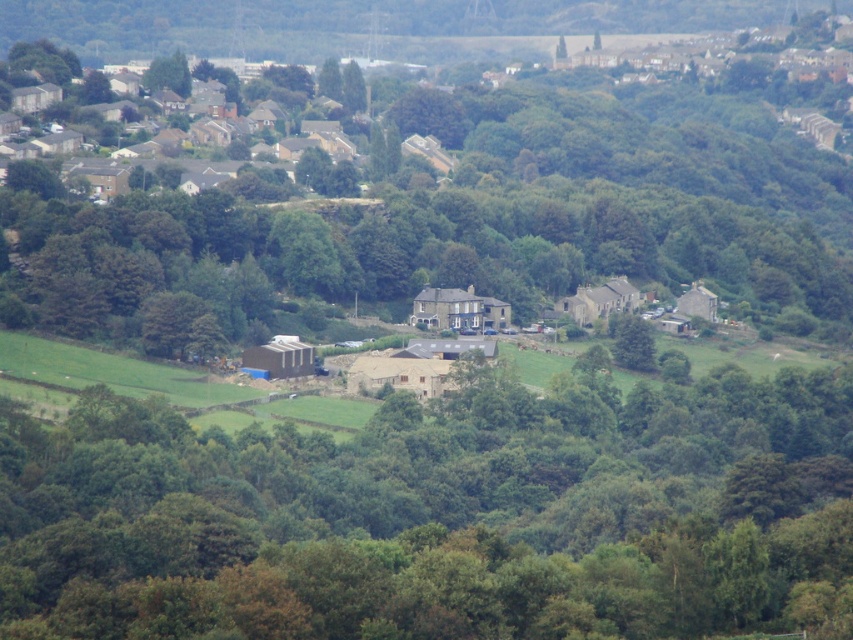
Is point (434, 577) less distant than point (627, 170)?

Yes.

Is brown wooden barn at center taller than green leafy trees at center?

No, brown wooden barn at center is not taller than green leafy trees at center.

Between point (564, 516) and point (770, 90), which one is positioned behind?

Point (770, 90)

At what (x,y) coordinates should I click in order to perform the action: click on brown wooden barn at center. Please return your answer as a coordinate pair (x, y). Image resolution: width=853 pixels, height=640 pixels. Looking at the image, I should click on (440, 515).